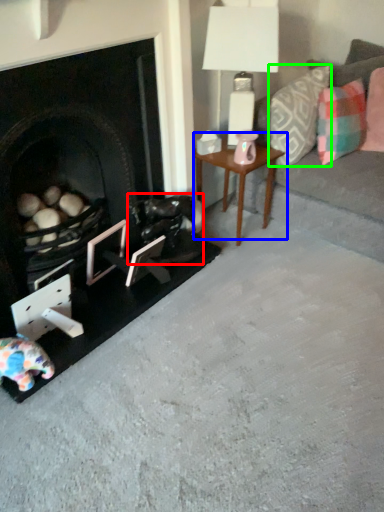
Question: Considering the real-world distances, which object is closest to swivel chair (highlighted by a red box)? table (highlighted by a blue box) or pillow (highlighted by a green box).

Choices:
 (A) table
 (B) pillow

Answer: (A)